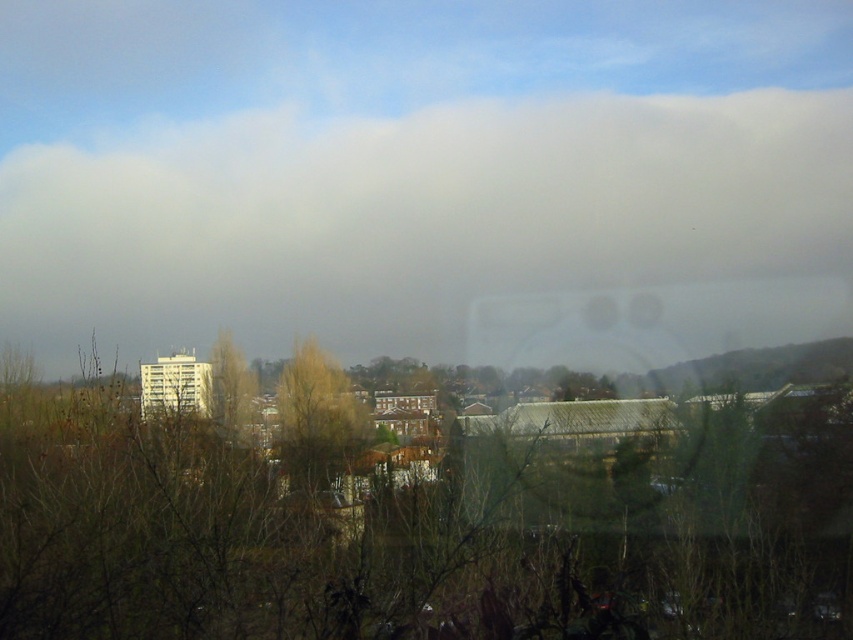
You are a bird looking for a place to perch. You see a brown leafless tree at center and a green matte tree at center. Which tree is closer to the ground where you can land?

The brown leafless tree at center is positioned under the green matte tree at center, so it is closer to the ground and easier to land on.

You are standing in the town square and see both the brown textured tree at center and the green matte tree at center. Which tree appears closer to you?

The brown textured tree at center appears closer because it is positioned further to the viewer than the green matte tree at center.

You are an urban planner analyzing the town layout. You observe the brown leafless tree at center and the brown textured tree at center. Which tree has a larger width according to the scene?

The brown leafless tree at center has a larger width than the brown textured tree at center.